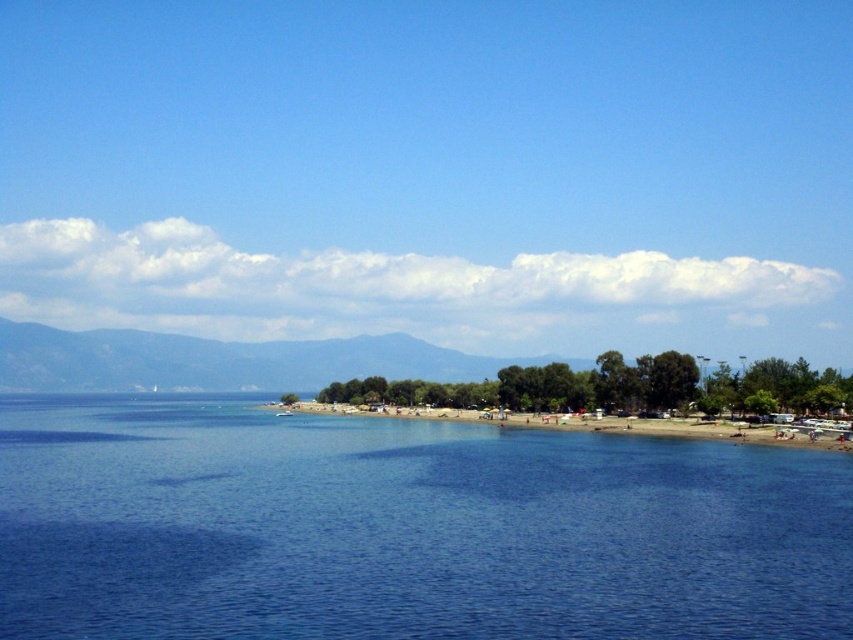
Question: Is blue water at center below green leafy mountain at center?

Choices:
 (A) no
 (B) yes

Answer: (A)

Question: From the image, what is the correct spatial relationship of blue water at center in relation to green leafy mountain at center?

Choices:
 (A) right
 (B) left

Answer: (A)

Question: Does blue water at center lie in front of green leafy mountain at center?

Choices:
 (A) no
 (B) yes

Answer: (B)